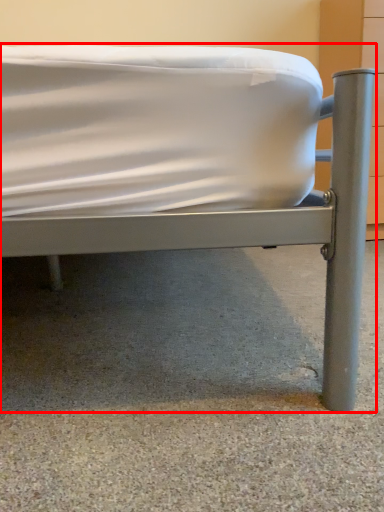
Question: From the image, what is the correct spatial relationship of bed (annotated by the red box) in relation to concrete?

Choices:
 (A) left
 (B) right

Answer: (A)